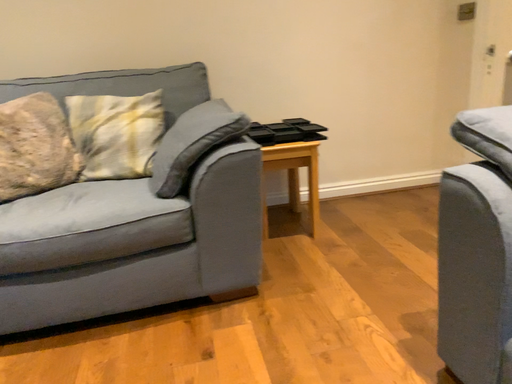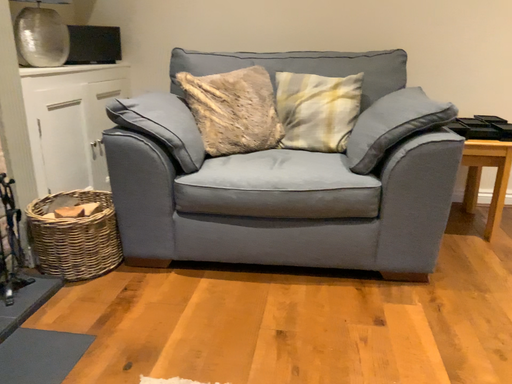
Question: How did the camera likely rotate when shooting the video?

Choices:
 (A) rotated left
 (B) rotated right

Answer: (A)